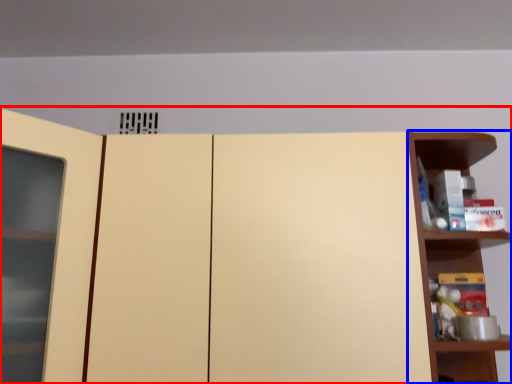
Question: Among these objects, which one is nearest to the camera, cupboard (highlighted by a red box) or shelf (highlighted by a blue box)?

Choices:
 (A) cupboard
 (B) shelf

Answer: (A)